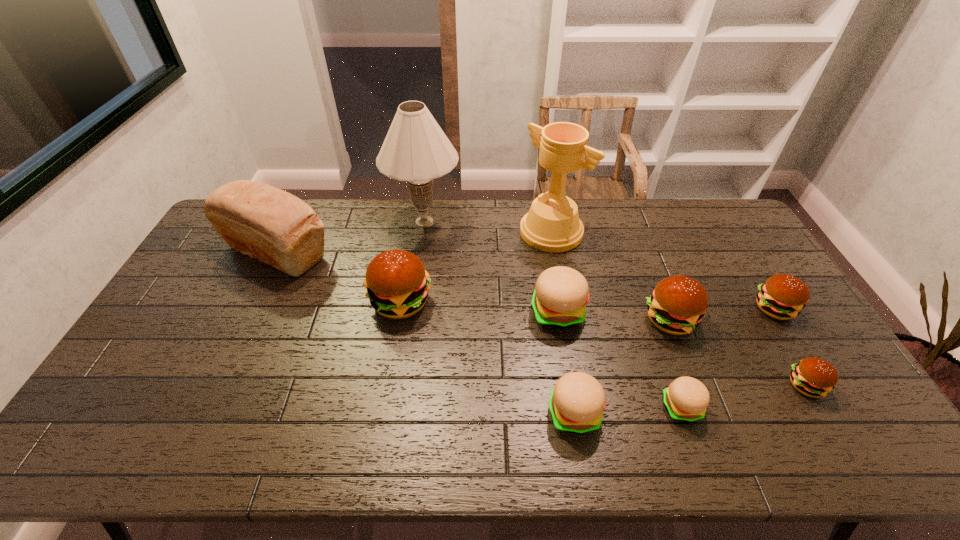
In order to click on the smallest brown hamburger in this screenshot , I will do `click(814, 377)`.

Where is `the smallest beige hamburger`? the smallest beige hamburger is located at coordinates (686, 399).

This screenshot has width=960, height=540. I want to click on vacant space positioned 0.330m on the front of the lampshade, so click(x=411, y=319).

The width and height of the screenshot is (960, 540). Identify the location of vacant region located on the front of the beige award. (568, 328).

Locate an element on the screen. vacant space located 0.380m on the right of the leftmost object is located at coordinates (445, 252).

Find the location of `free space located 0.060m on the left of the leftmost brown hamburger`. free space located 0.060m on the left of the leftmost brown hamburger is located at coordinates (349, 302).

The width and height of the screenshot is (960, 540). Find the location of `vacant area situated 0.290m on the front of the third brown hamburger from right to left`. vacant area situated 0.290m on the front of the third brown hamburger from right to left is located at coordinates (717, 441).

Find the location of a particular element. The image size is (960, 540). vacant area situated on the back of the farthest beige hamburger is located at coordinates (547, 243).

Identify the location of vacant space located on the back of the second smallest brown hamburger. This screenshot has width=960, height=540. (738, 251).

At what (x,y) coordinates should I click in order to perform the action: click on free space located on the right of the second biggest beige hamburger. Please return your answer as a coordinate pair (x, y). The height and width of the screenshot is (540, 960). Looking at the image, I should click on (713, 413).